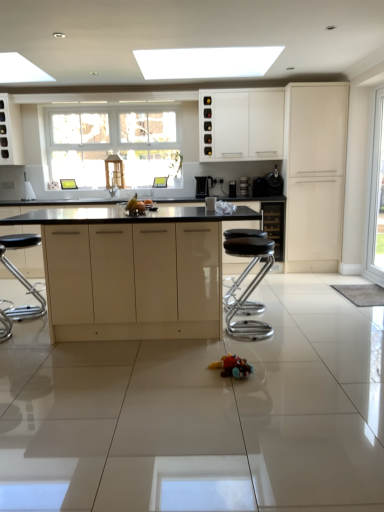
Question: Considering their positions, is white glossy cabinet at upper center, the second cabinetry in the left-to-right sequence, located in front of or behind metallic silver coffee machine at center, positioned as the second appliance in left-to-right order?

Choices:
 (A) behind
 (B) front

Answer: (B)

Question: From the image's perspective, is white glossy cabinet at upper center, which appears as the 2th cabinetry when viewed from the back, above or below metallic silver coffee machine at center, positioned as the second appliance in left-to-right order?

Choices:
 (A) below
 (B) above

Answer: (B)

Question: Which object is positioned farthest from the multicolored plastic toy at center?

Choices:
 (A) glossy white cabinets at center, the first cabinetry positioned from the front
 (B) white glossy cabinet at upper center, acting as the 3th cabinetry starting from the right
 (C) black glossy coffee machine at center, marked as the 3th appliance in a left-to-right arrangement
 (D) black glossy coffee maker at right, placed as the 1th appliance when sorted from right to left
 (E) matte white cabinet at right, which ranks as the third cabinetry in back-to-front order

Answer: (B)

Question: Which is nearer to the glossy white cabinets at center, which is the fourth cabinetry in back-to-front order?

Choices:
 (A) white glossy cabinet at upper center, acting as the 3th cabinetry starting from the right
 (B) matte white cabinet at right, the 4th cabinetry in the left-to-right sequence
 (C) black glossy coffee machine at center, marked as the 3th appliance in a left-to-right arrangement
 (D) transparent glass door at right
 (E) metallic silver coffee machine at center, positioned as the second appliance in left-to-right order

Answer: (C)